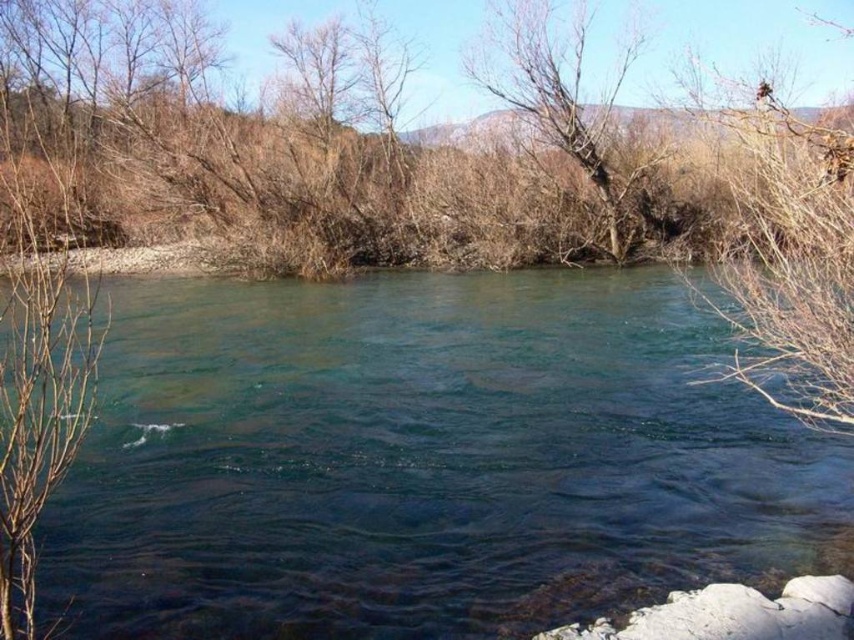
You are an artist sketching the scene and want to place the bare branches at upper right accurately. According to the coordinates provided, where should you position them on your canvas?

The bare branches at upper right should be positioned at the coordinates point (x=790, y=259) on your canvas.

You are standing at the riverbank and want to reach a specific point marked as point [401,342]. Given that the distance between you and this point is 14.31 meters, and you have a rope that is 12 meters long, can you safely cross the river to reach that point without getting wet?

The distance between you and point [401,342] is 14.31 meters, but your rope is only 12 meters long. Therefore, the rope is not long enough to safely reach the point without getting wet.